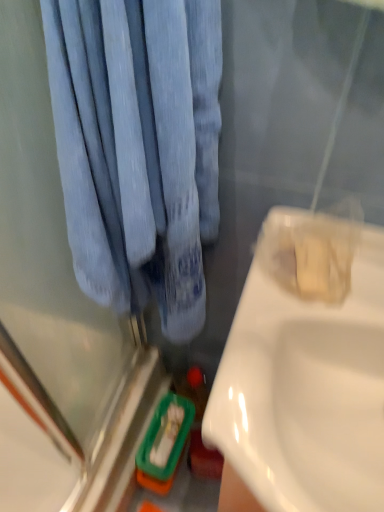
Question: In terms of height, does white glossy sink at right look taller or shorter compared to blue fabric curtain at upper left?

Choices:
 (A) tall
 (B) short

Answer: (A)

Question: Looking at their shapes, would you say white glossy sink at right is wider or thinner than blue fabric curtain at upper left?

Choices:
 (A) wide
 (B) thin

Answer: (A)

Question: Considering the relative positions of white glossy sink at right and blue fabric curtain at upper left in the image provided, is white glossy sink at right to the left or to the right of blue fabric curtain at upper left?

Choices:
 (A) left
 (B) right

Answer: (B)

Question: Is blue fabric curtain at upper left taller or shorter than white glossy sink at right?

Choices:
 (A) short
 (B) tall

Answer: (A)

Question: Choose the correct answer: Is blue fabric curtain at upper left inside white glossy sink at right or outside it?

Choices:
 (A) outside
 (B) inside

Answer: (A)

Question: Looking at their shapes, would you say blue fabric curtain at upper left is wider or thinner than white glossy sink at right?

Choices:
 (A) wide
 (B) thin

Answer: (B)

Question: In the image, is blue fabric curtain at upper left positioned in front of or behind white glossy sink at right?

Choices:
 (A) behind
 (B) front

Answer: (B)